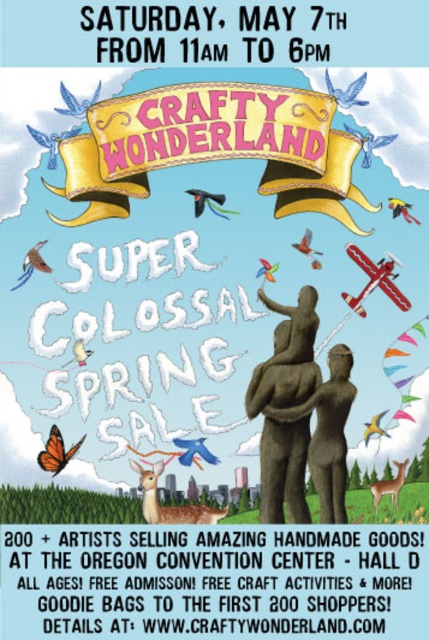
You are standing at the camera position looking at the Crafty Wonderland poster. There is an orange paper kite at lower left. Can you reach the kite without moving your position?

The orange paper kite at lower left is 120.73 meters away from camera, so you cannot reach it without moving your position.

Looking at the Crafty Wonderland poster, you notice two red matte items at the upper right corner. Which one is higher positioned between the red matte airplane at upper right and the red matte kite at upper right?

The red matte airplane at upper right is positioned higher than the red matte kite at upper right.